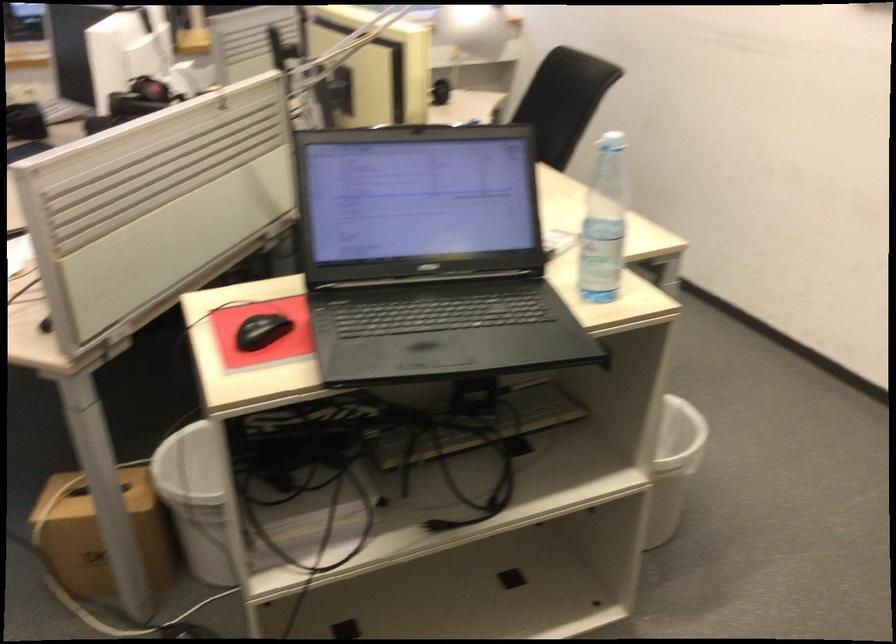
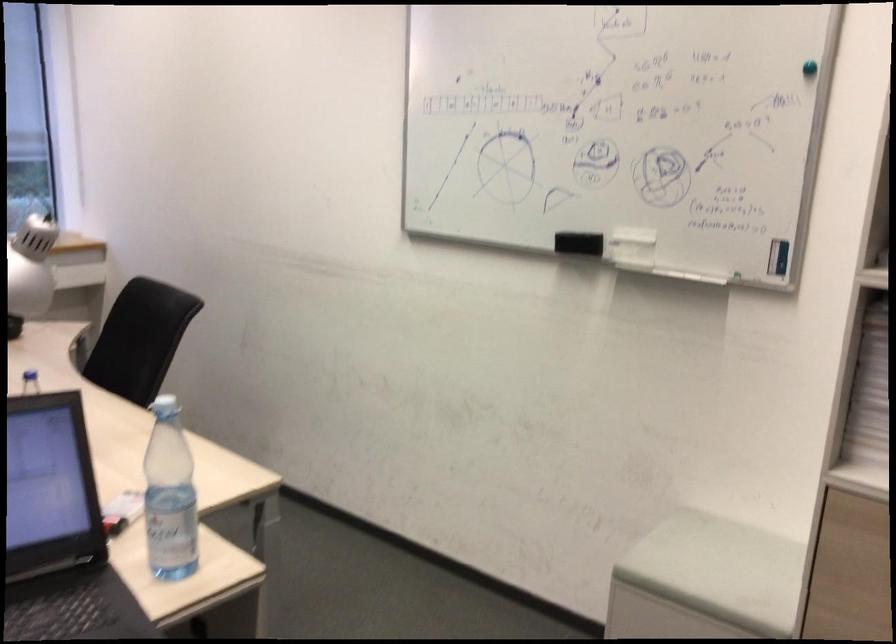
Question: The images are taken continuously from a first-person perspective. In which direction are you moving?

Choices:
 (A) Left
 (B) Right
 (C) Forward
 (D) Backward

Answer: (B)